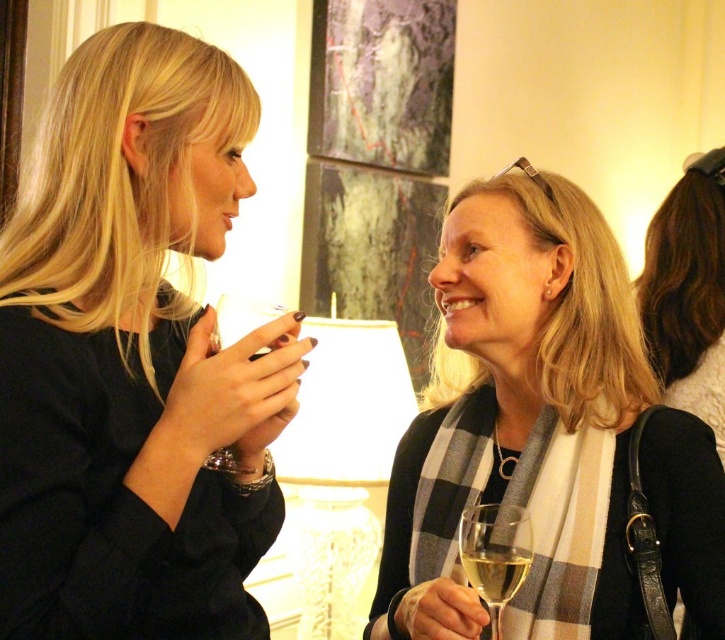
Describe the element at coordinates (544, 433) in the screenshot. I see `plaid scarf at center` at that location.

Is plaid scarf at center closer to camera compared to clear glass wine glass at center?

No, it is not.

Locate an element on the screen. This screenshot has height=640, width=725. plaid scarf at center is located at coordinates (544, 433).

Image resolution: width=725 pixels, height=640 pixels. I want to click on plaid scarf at center, so pyautogui.click(x=544, y=433).

Does plaid scarf at center appear over clear glass wine glass at lower right?

Yes, plaid scarf at center is above clear glass wine glass at lower right.

Does point (407, 577) come closer to viewer compared to point (472, 582)?

No.

Which is behind, point (542, 547) or point (486, 564)?

Point (542, 547)

This screenshot has width=725, height=640. In order to click on plaid scarf at center in this screenshot , I will do `click(544, 433)`.

Who is more forward, (459, 547) or (218, 340)?

Positioned in front is point (218, 340).

Is clear glass wine glass at lower right below clear glass wine glass at center?

Indeed, clear glass wine glass at lower right is positioned under clear glass wine glass at center.

Where is `clear glass wine glass at lower right`? This screenshot has width=725, height=640. clear glass wine glass at lower right is located at coordinates (494, 554).

Locate an element on the screen. The height and width of the screenshot is (640, 725). clear glass wine glass at lower right is located at coordinates (494, 554).